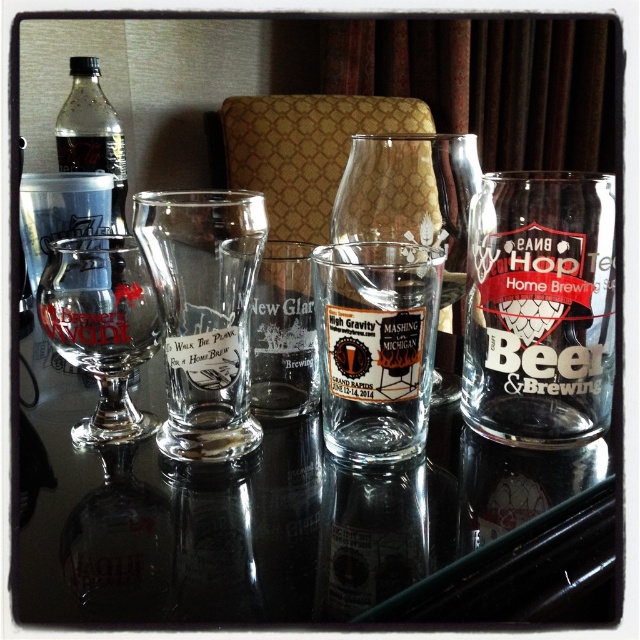
Which of these two, clear glass shot glass at center or translucent plastic bottle at upper left, stands taller?

translucent plastic bottle at upper left is taller.

Is clear glass shot glass at center positioned at the back of translucent plastic bottle at upper left?

That is False.

Does point (177, 413) come in front of point (109, 125)?

Yes, it is.

This screenshot has width=640, height=640. Find the location of `clear glass shot glass at center`. clear glass shot glass at center is located at coordinates [204, 314].

Is transparent glass at center closer to camera compared to clear glass at center?

Yes, it is in front of clear glass at center.

Describe the element at coordinates (310, 531) in the screenshot. I see `transparent glass at center` at that location.

What do you see at coordinates (310, 531) in the screenshot? This screenshot has height=640, width=640. I see `transparent glass at center` at bounding box center [310, 531].

Find the location of a particular element. This screenshot has width=640, height=640. transparent glass at center is located at coordinates (310, 531).

From the picture: Is transparent glass at center bigger than clear glass shot glass at center?

Yes.

Is transparent glass at center smaller than clear glass shot glass at center?

No, transparent glass at center is not smaller than clear glass shot glass at center.

Image resolution: width=640 pixels, height=640 pixels. I want to click on transparent glass at center, so click(310, 531).